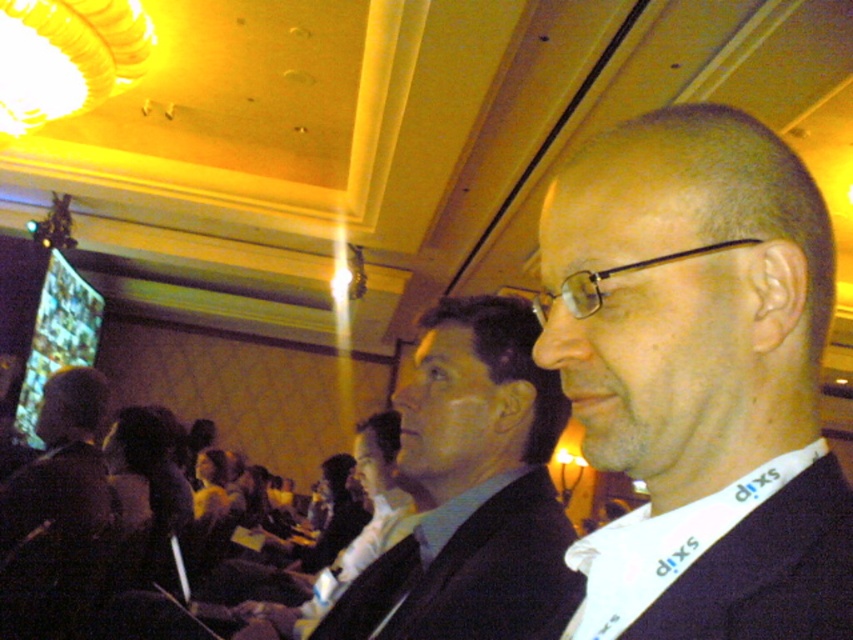
You are a photographer setting up for a group photo at the conference. You need to position yourself between the dark blue suit at center and the dark brown leather jacket at left to capture both in the frame. Given that your camera has a maximum focal length that allows a 1.5 meter wide shot, will you be able to include both subjects in the same frame?

The distance between the dark blue suit at center and the dark brown leather jacket at left is 1.69 meters. Since the camera can only capture up to 1.5 meters in width, the two subjects are slightly too far apart to fit within the same frame.

You are organizing a photo shoot for a fashion magazine and need to arrange two models wearing the dark blue suit at center and the dark suit at center in a line. Based on their heights, which model should stand in front to ensure both are visible?

The dark blue suit at center should stand in front because it is shorter than the dark suit at center, allowing the taller model to be seen behind.